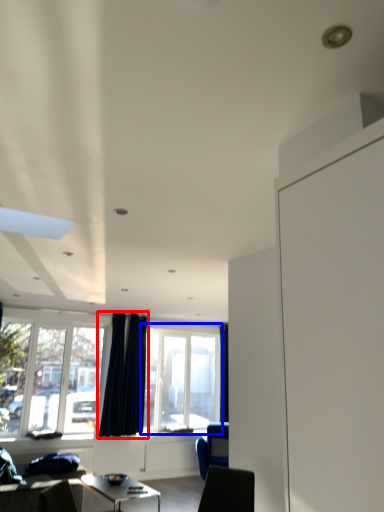
Question: Which point is further to the camera, curtain (highlighted by a red box) or window (highlighted by a blue box)?

Choices:
 (A) curtain
 (B) window

Answer: (B)